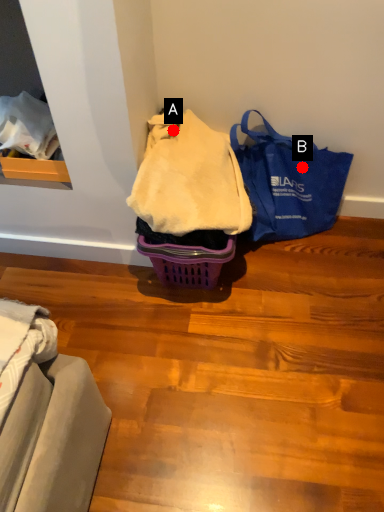
Question: Two points are circled on the image, labeled by A and B beside each circle. Which point is closer to the camera?

Choices:
 (A) A is closer
 (B) B is closer

Answer: (A)